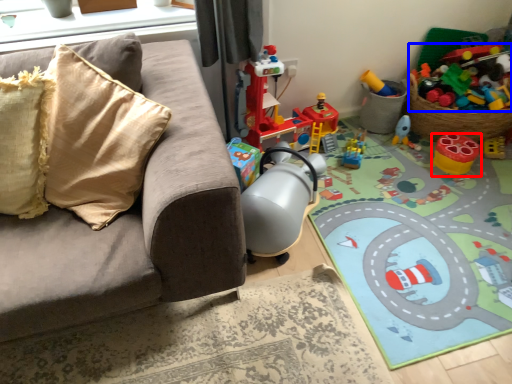
Question: Which of the following is the closest to the observer, toy (highlighted by a red box) or toy (highlighted by a blue box)?

Choices:
 (A) toy
 (B) toy

Answer: (A)